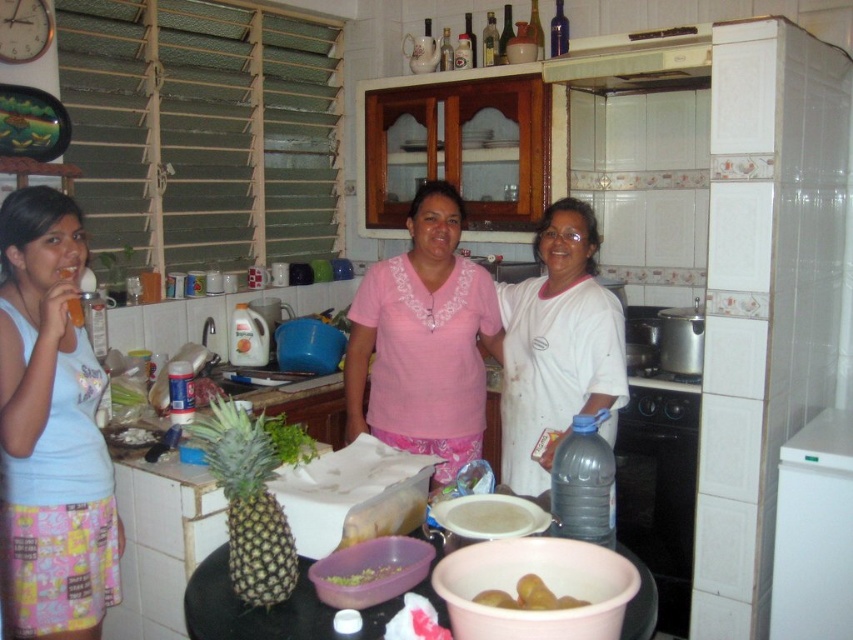
Question: Is white cotton tank top at left to the left of green leafy vegetable at center from the viewer's perspective?

Choices:
 (A) no
 (B) yes

Answer: (B)

Question: Is white cotton shirt at center above green leafy vegetable at center?

Choices:
 (A) yes
 (B) no

Answer: (A)

Question: Which of these objects is positioned farthest from the green textured pineapple at center?

Choices:
 (A) white cotton tank top at left
 (B) green leafy vegetable at center

Answer: (A)

Question: In this image, where is green textured pineapple at center located relative to green leafy vegetable at center?

Choices:
 (A) below
 (B) above

Answer: (B)

Question: Considering the real-world distances, which object is farthest from the pink lace fabric at center?

Choices:
 (A) white cotton shirt at center
 (B) yellow matte kiwi at lower center

Answer: (B)

Question: Considering the real-world distances, which object is farthest from the green leafy vegetable at center?

Choices:
 (A) pink lace fabric at center
 (B) white cotton tank top at left

Answer: (A)